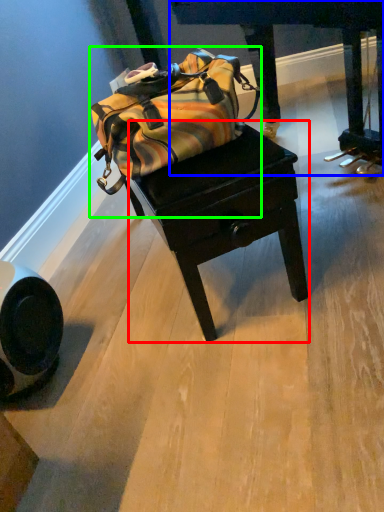
Question: Estimate the real-world distances between objects in this image. Which object is closer to table (highlighted by a red box), furniture (highlighted by a blue box) or luggage and bags (highlighted by a green box)?

Choices:
 (A) furniture
 (B) luggage and bags

Answer: (B)